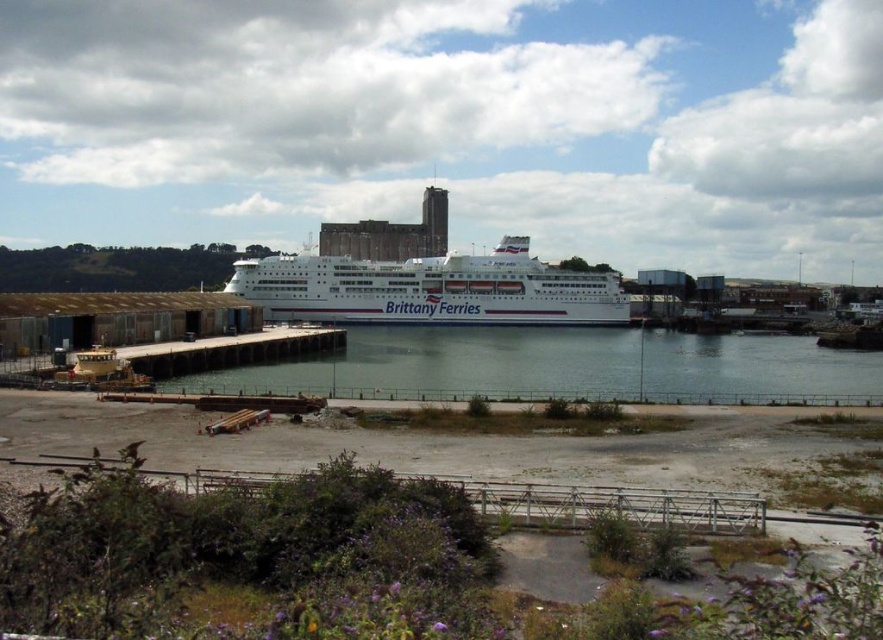
Is clear water at dock center taller than white glossy cruise ship at center?

No.

Is clear water at dock center shorter than white glossy cruise ship at center?

Yes, clear water at dock center is shorter than white glossy cruise ship at center.

Measure the distance between clear water at dock center and camera.

clear water at dock center is 64.04 meters from camera.

I want to click on clear water at dock center, so click(565, 365).